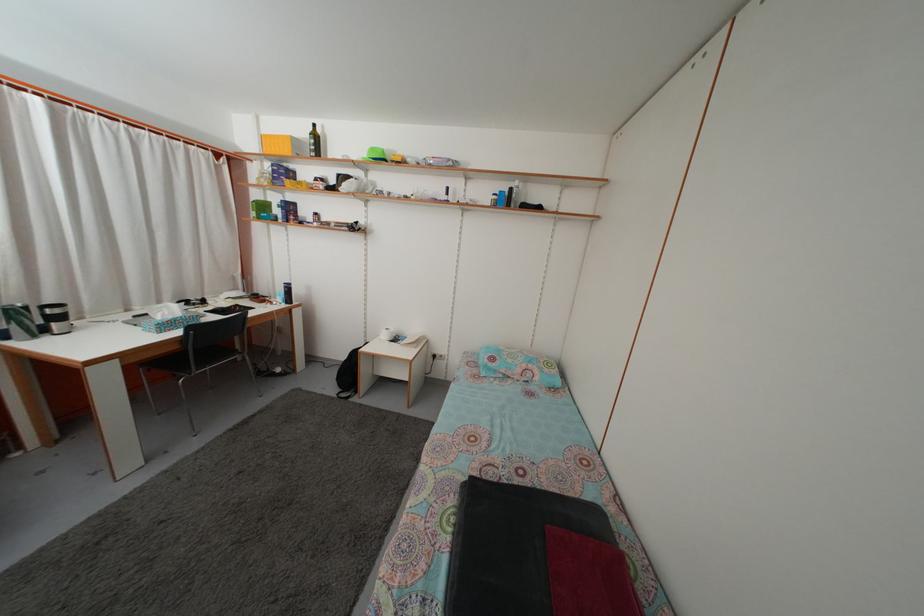
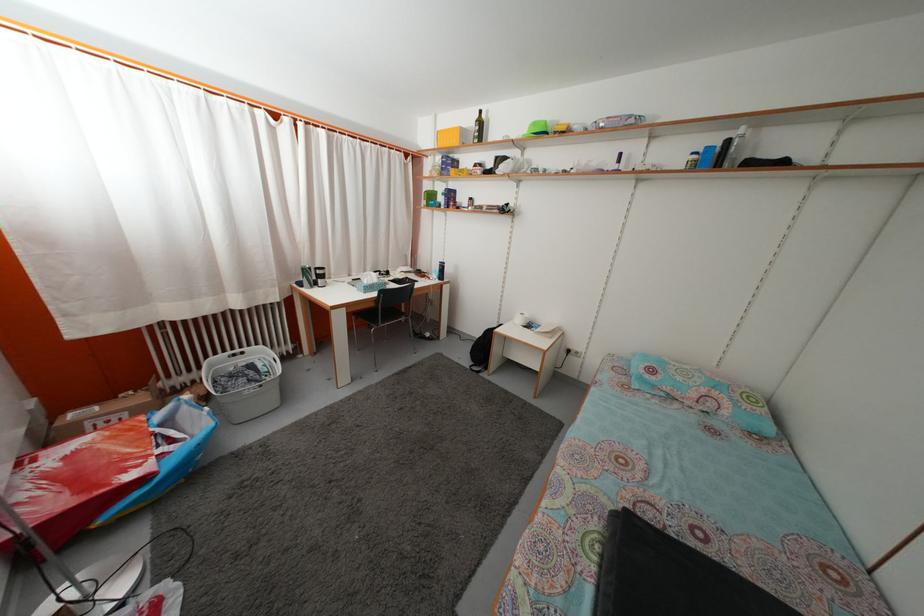
Where in the second image is the point corresponding to pixel 307 138 from the first image?

(475, 127)